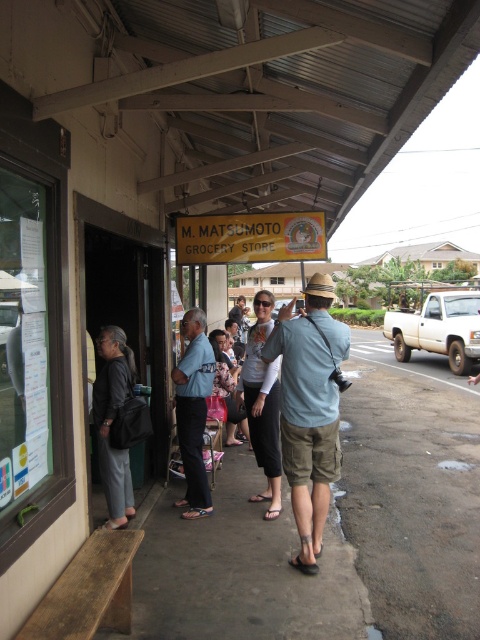
Question: Which object is farther from the camera taking this photo?

Choices:
 (A) dark gray fabric pants at left
 (B) matte black shirt at center
 (C) light blue cotton shirt at center

Answer: (B)

Question: Which object appears farthest from the camera in this image?

Choices:
 (A) light blue cotton shirt at center
 (B) matte black shirt at center
 (C) blue denim shirt at center
 (D) dark gray fabric pants at left

Answer: (B)

Question: Can you confirm if blue denim shirt at center is positioned above dark gray fabric pants at left?

Choices:
 (A) yes
 (B) no

Answer: (A)

Question: Does light blue cotton shirt at center have a greater width compared to blue denim shirt at center?

Choices:
 (A) yes
 (B) no

Answer: (A)

Question: Can you confirm if blue denim shirt at center is positioned below matte black shirt at center?

Choices:
 (A) yes
 (B) no

Answer: (A)

Question: Which object is positioned closest to the blue denim shirt at center?

Choices:
 (A) matte black shirt at center
 (B) dark gray fabric pants at left

Answer: (B)